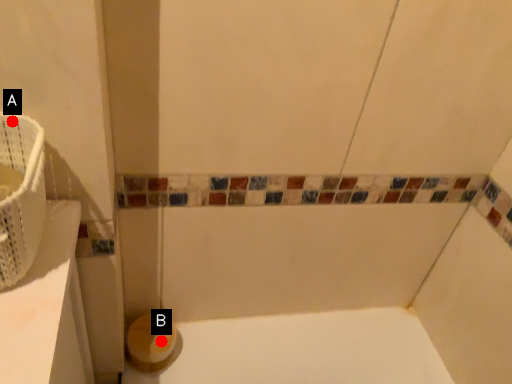
Question: Two points are circled on the image, labeled by A and B beside each circle. Among these points, which one is farthest from the camera?

Choices:
 (A) A is further
 (B) B is further

Answer: (B)